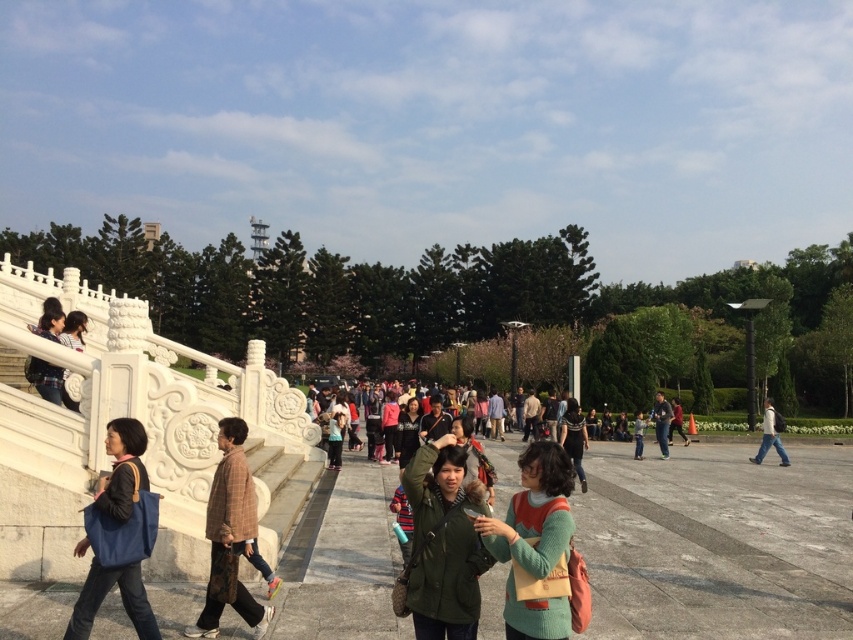
Is green knitted sweater at center positioned in front of dark blue jeans at center?

Yes, green knitted sweater at center is in front of dark blue jeans at center.

What do you see at coordinates (534, 541) in the screenshot? I see `green knitted sweater at center` at bounding box center [534, 541].

You are a GUI agent. You are given a task and a screenshot of the screen. Output one action in this format:
    pyautogui.click(x=<x>, y=<y>)
    Task: Click on the green knitted sweater at center
    This screenshot has width=853, height=640.
    Given the screenshot: What is the action you would take?
    pyautogui.click(x=534, y=541)

Where is `green knitted sweater at center`? The image size is (853, 640). green knitted sweater at center is located at coordinates (534, 541).

Does white matte jacket at center-right appear on the left side of dark blue jeans at center?

In fact, white matte jacket at center-right is to the right of dark blue jeans at center.

Between white matte jacket at center-right and dark blue jeans at center, which one has more height?

Standing taller between the two is white matte jacket at center-right.

This screenshot has height=640, width=853. I want to click on white matte jacket at center-right, so click(x=769, y=435).

Describe the element at coordinates (102, 598) in the screenshot. I see `matte blue bag at lower left` at that location.

Does matte blue bag at lower left have a lesser width compared to matte black jacket at upper left?

Yes, matte blue bag at lower left is thinner than matte black jacket at upper left.

Does point (67, 630) come farther from viewer compared to point (44, 376)?

That is False.

Image resolution: width=853 pixels, height=640 pixels. Identify the location of matte blue bag at lower left. (102, 598).